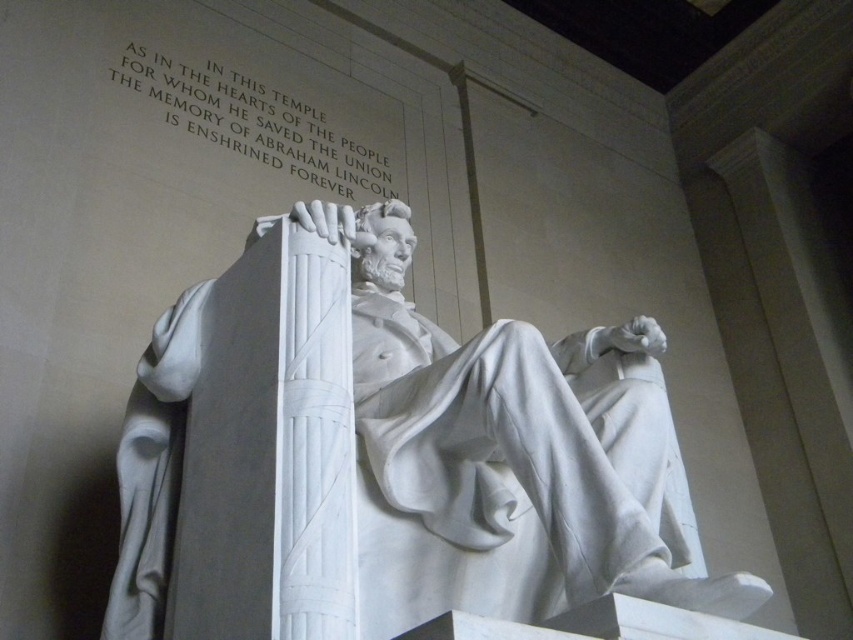
You are standing in front of the Lincoln statue and notice two points marked on the wall. The first point is at coordinates point [512,349], and the second is at point [383,108]. If you want to touch both points starting from your current position, which point should you reach first to minimize the distance walked?

You should reach point [383,108] first because it is closer to you than point [512,349], which is further away.